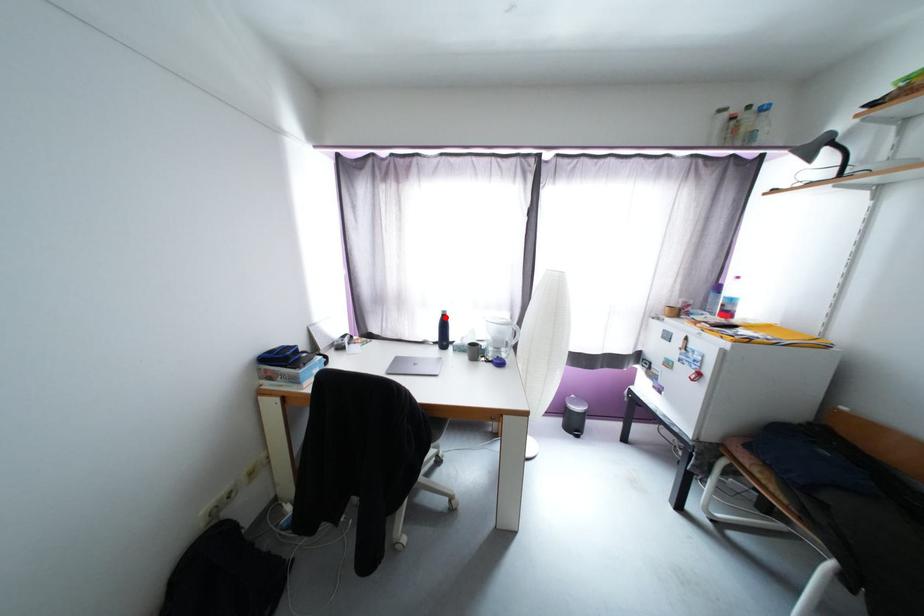
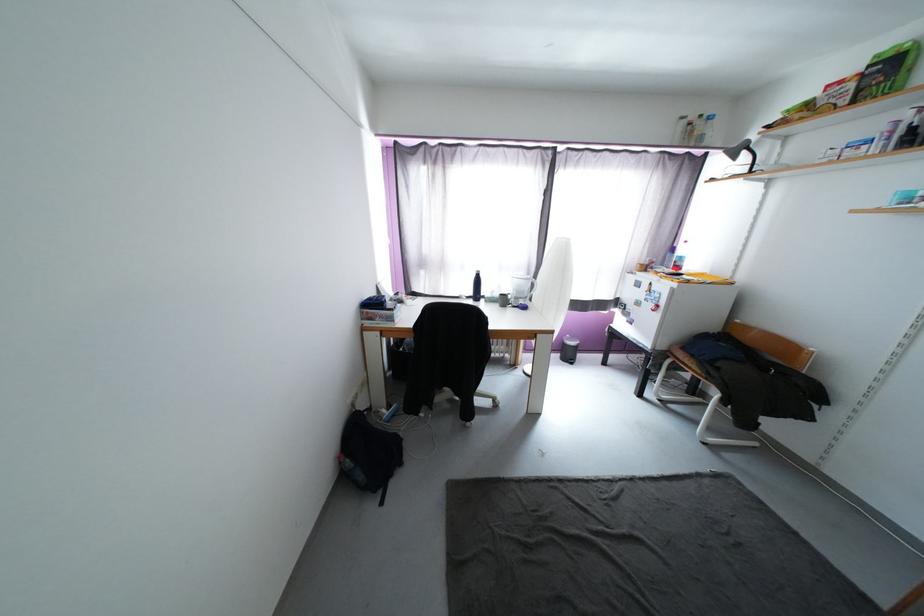
In the second image, find the point that corresponds to the highlighted location in the first image.

(480, 277)